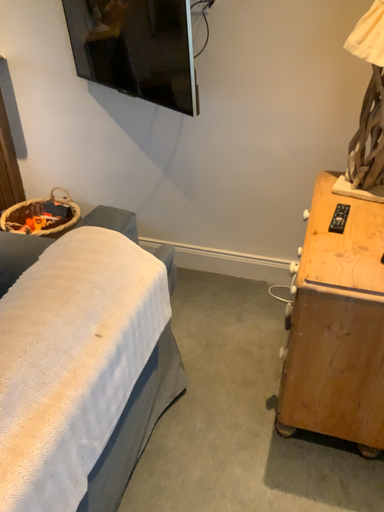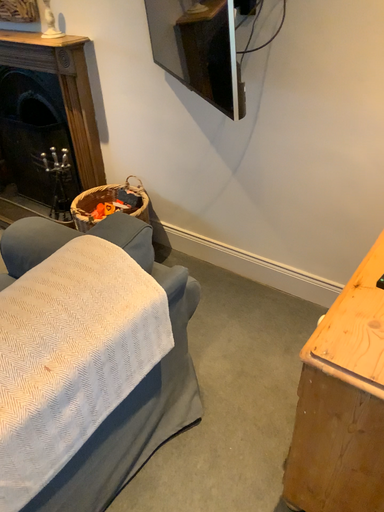
Question: Which way did the camera rotate in the video?

Choices:
 (A) rotated left
 (B) rotated right

Answer: (A)